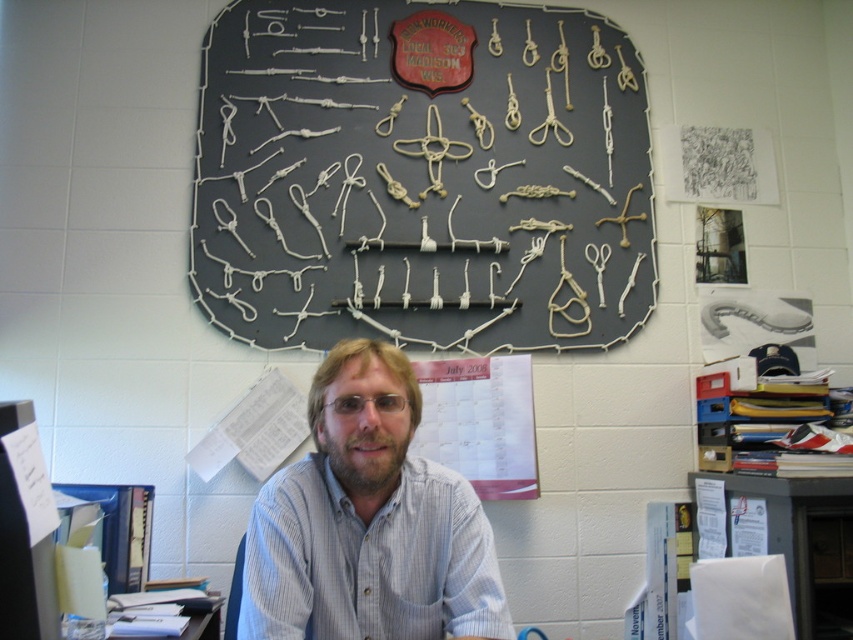
What is located at the coordinates point (368, 522) in the image?

The blue striped shirt at center is located at point (368, 522).